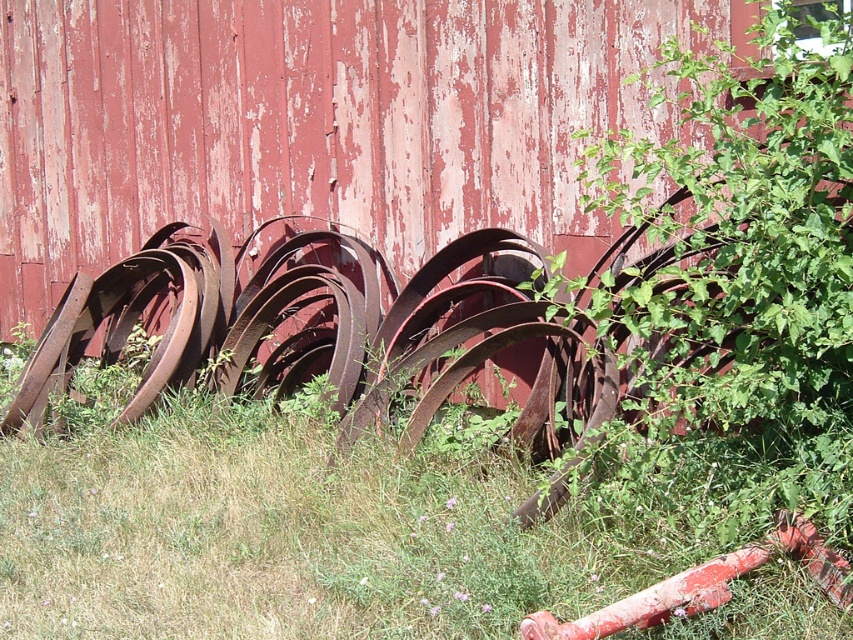
Does green grass at lower left have a lesser height compared to green leafy plant at right?

Yes, green grass at lower left is shorter than green leafy plant at right.

Is green grass at lower left in front of green leafy plant at right?

No.

Is point (86, 627) positioned before point (759, 244)?

That is False.

Where is `green grass at lower left`? The height and width of the screenshot is (640, 853). green grass at lower left is located at coordinates (294, 531).